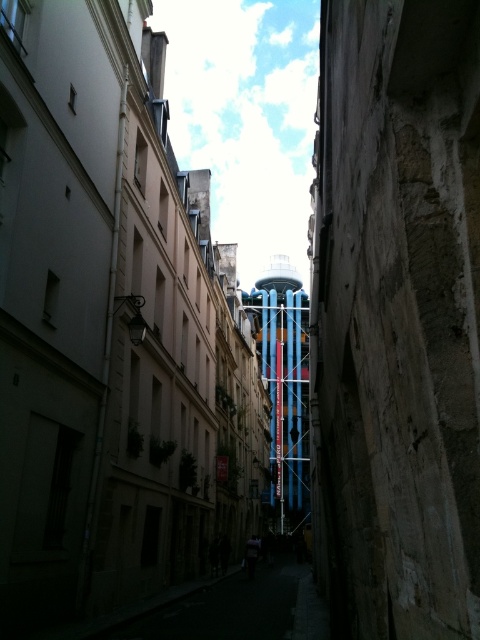
Question: Which of the following is the farthest from the observer?

Choices:
 (A) weathered stone wall at center
 (B) blue metallic scaffolding at center

Answer: (B)

Question: Does weathered stone wall at center appear on the right side of blue metallic scaffolding at center?

Choices:
 (A) no
 (B) yes

Answer: (B)

Question: Does weathered stone wall at center appear over blue metallic scaffolding at center?

Choices:
 (A) no
 (B) yes

Answer: (B)

Question: Can you confirm if weathered stone wall at center is positioned to the left of blue metallic scaffolding at center?

Choices:
 (A) no
 (B) yes

Answer: (A)

Question: Which of the following is the farthest from the observer?

Choices:
 (A) weathered stone wall at center
 (B) blue metallic scaffolding at center

Answer: (B)